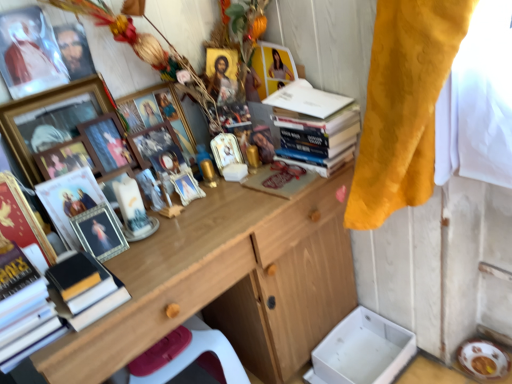
Find the location of `free space in front of matte brown book at center, the second magazine positioned from the left`. free space in front of matte brown book at center, the second magazine positioned from the left is located at coordinates click(x=264, y=211).